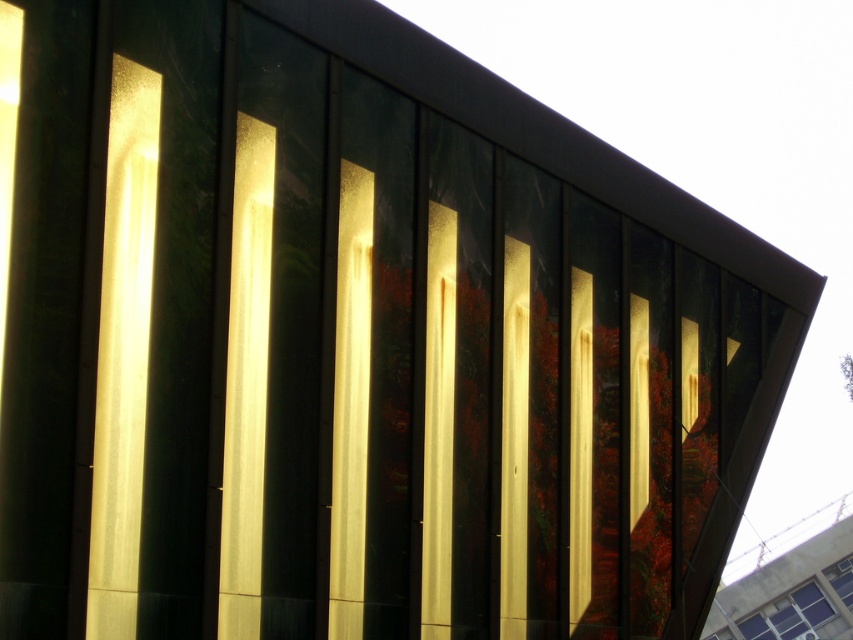
Between clear glass window at lower right and transparent glass window at lower right, which one has more height?

clear glass window at lower right

Who is positioned more to the right, clear glass window at lower right or transparent glass window at lower right?

transparent glass window at lower right

Is point (834, 611) closer to camera compared to point (836, 570)?

No, it is not.

Where is `clear glass window at lower right`? This screenshot has width=853, height=640. clear glass window at lower right is located at coordinates (788, 616).